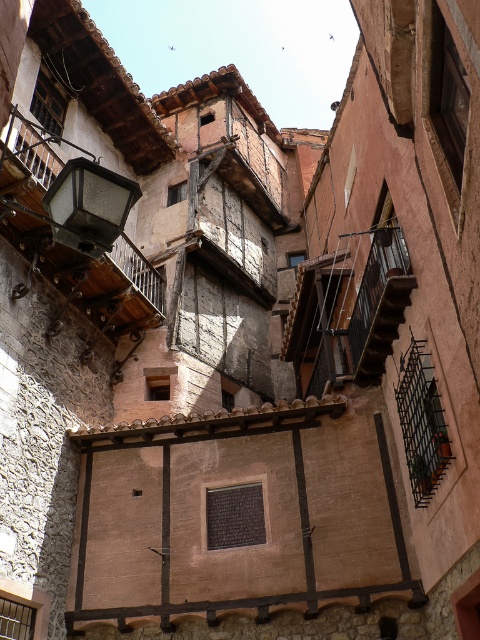
Does matte black lantern at upper left have a greater height compared to wooden stairs at center?

No, matte black lantern at upper left is not taller than wooden stairs at center.

Who is more forward, (54, 205) or (354, 339)?

Point (54, 205) is more forward.

Who is more forward, (96, 173) or (387, 346)?

Point (96, 173) is more forward.

This screenshot has height=640, width=480. What are the coordinates of `matte black lantern at upper left` in the screenshot? It's located at (88, 205).

Which is more to the left, wooden balcony at left or wooden stairs at center?

Positioned to the left is wooden balcony at left.

Is point (90, 301) more distant than point (402, 320)?

Yes, point (90, 301) is behind point (402, 320).

Locate an element on the screen. wooden balcony at left is located at coordinates (31, 170).

Can you confirm if wooden balcony at left is positioned above matte black lantern at upper left?

Indeed, wooden balcony at left is positioned over matte black lantern at upper left.

Does wooden balcony at left lie behind matte black lantern at upper left?

No, wooden balcony at left is in front of matte black lantern at upper left.

Between point (6, 141) and point (111, 232), which one is positioned behind?

Positioned behind is point (6, 141).

The width and height of the screenshot is (480, 640). I want to click on wooden balcony at left, so click(31, 170).